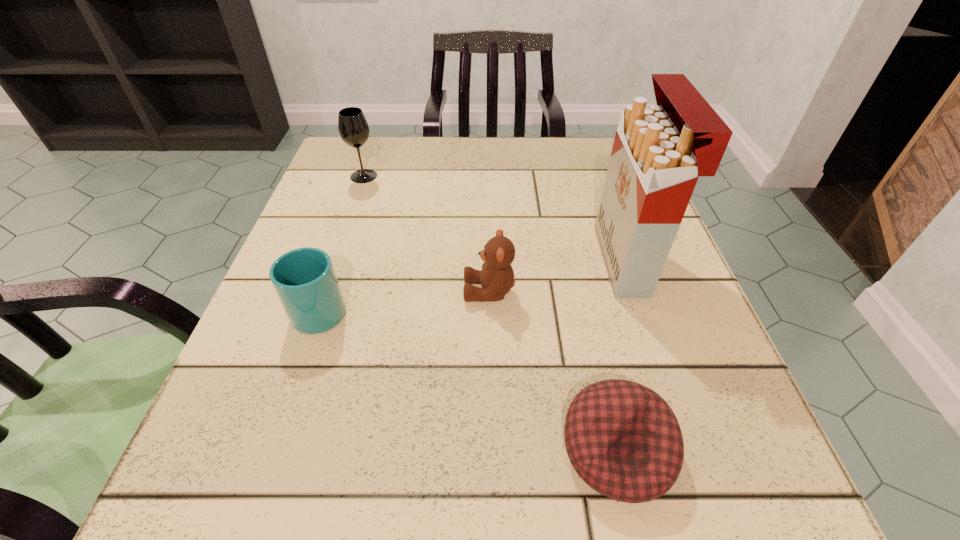
Find the location of a particular element. Image resolution: width=960 pixels, height=540 pixels. vacant space located on the front of the wineglass is located at coordinates (341, 244).

You are a GUI agent. You are given a task and a screenshot of the screen. Output one action in this format:
    pyautogui.click(x=<x>, y=<y>)
    Task: Click on the free point located on the face of the third object from left to right
    The height and width of the screenshot is (540, 960).
    Given the screenshot: What is the action you would take?
    pyautogui.click(x=331, y=291)

Image resolution: width=960 pixels, height=540 pixels. I want to click on free space located 0.060m on the face of the third object from left to right, so click(x=427, y=291).

Locate an element on the screen. vacant area situated 0.160m on the face of the third object from left to right is located at coordinates [x=367, y=291].

You are a GUI agent. You are given a task and a screenshot of the screen. Output one action in this format:
    pyautogui.click(x=<x>, y=<y>)
    Task: Click on the free space located on the handle side of the cup
    The width and height of the screenshot is (960, 540).
    Given the screenshot: What is the action you would take?
    pyautogui.click(x=366, y=174)

The height and width of the screenshot is (540, 960). I want to click on vacant position located 0.280m on the handle side of the cup, so click(361, 189).

Locate an element on the screen. vacant space located 0.230m on the handle side of the cup is located at coordinates (356, 203).

Find the location of a particular element. The width and height of the screenshot is (960, 540). vacant point located on the left of the beanbag is located at coordinates (488, 450).

Find the location of a particular element. object that is at the far edge is located at coordinates [353, 128].

The width and height of the screenshot is (960, 540). I want to click on object located in the near edge section of the desktop, so click(624, 441).